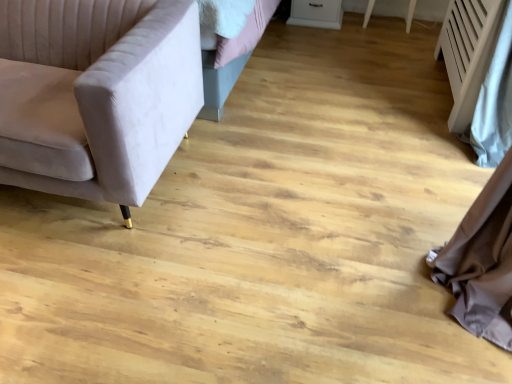
Question: From a real-world perspective, relative to white glossy drawer at upper center, is white textured radiator at right vertically above or below?

Choices:
 (A) below
 (B) above

Answer: (B)

Question: Is point (475, 43) positioned closer to the camera than point (290, 8)?

Choices:
 (A) closer
 (B) farther

Answer: (A)

Question: Which is nearer to the white textured radiator at right?

Choices:
 (A) velvet beige couch at left
 (B) white glossy drawer at upper center

Answer: (B)

Question: Which object is positioned farthest from the velvet beige couch at left?

Choices:
 (A) white glossy drawer at upper center
 (B) white textured radiator at right

Answer: (A)